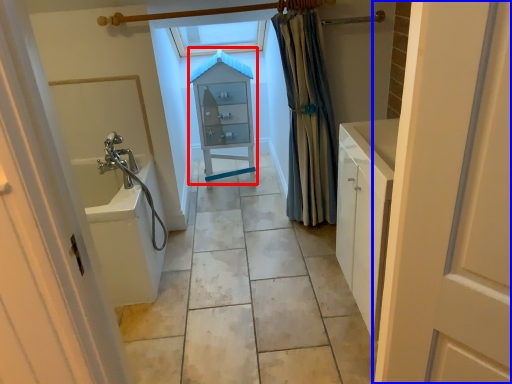
Question: Among these objects, which one is nearest to the camera, medicine cabinet (highlighted by a red box) or door (highlighted by a blue box)?

Choices:
 (A) medicine cabinet
 (B) door

Answer: (B)